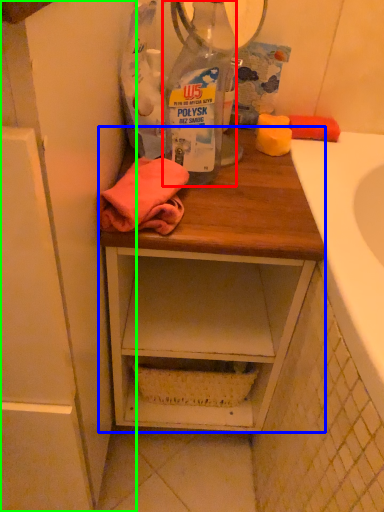
Question: Estimate the real-world distances between objects in this image. Which object is closer to bottle (highlighted by a red box), desk (highlighted by a blue box) or cabinetry (highlighted by a green box)?

Choices:
 (A) desk
 (B) cabinetry

Answer: (A)